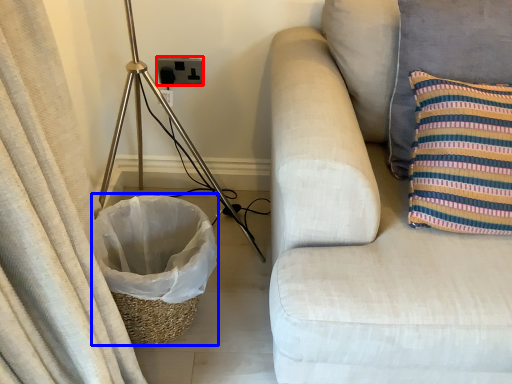
Question: Which point is closer to the camera, electric outlet (highlighted by a red box) or laundry basket (highlighted by a blue box)?

Choices:
 (A) electric outlet
 (B) laundry basket

Answer: (B)